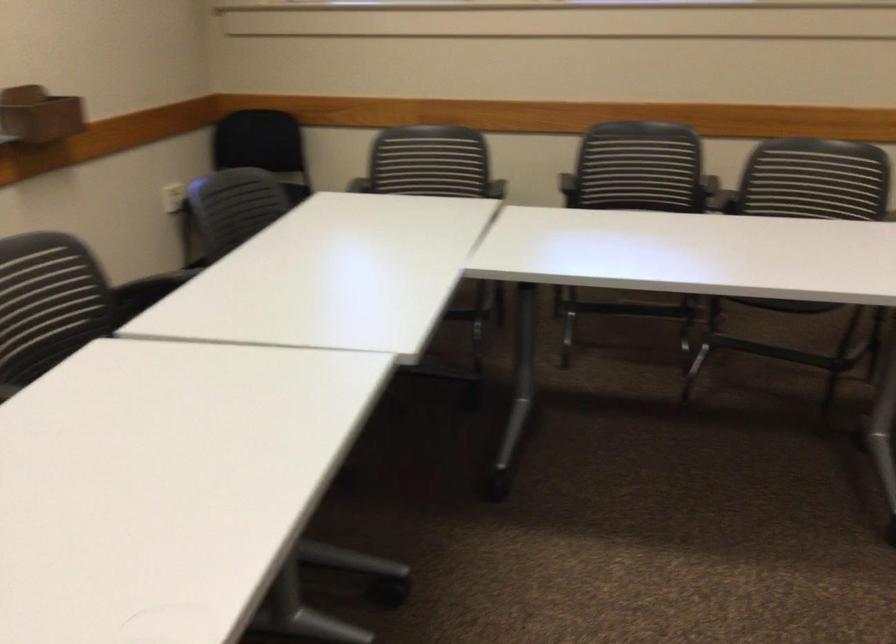
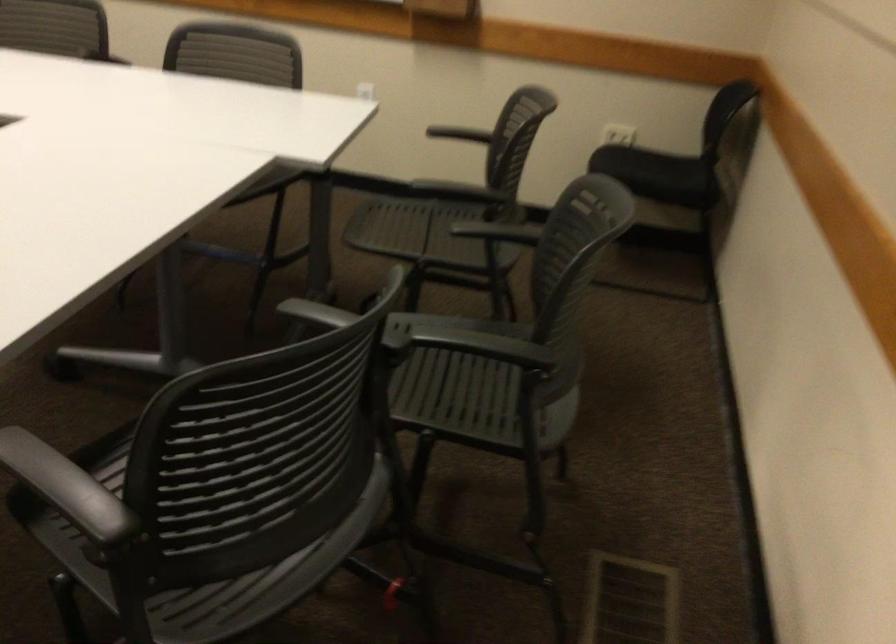
The point at (489, 187) is marked in the first image. Where is the corresponding point in the second image?

(461, 190)